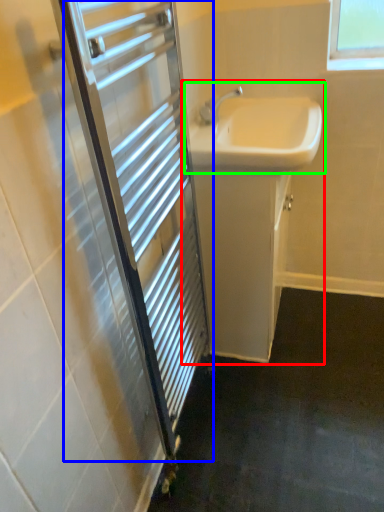
Question: Which object is positioned farthest from bathroom cabinet (highlighted by a red box)? Select from screen door (highlighted by a blue box) and sink (highlighted by a green box).

Choices:
 (A) screen door
 (B) sink

Answer: (A)